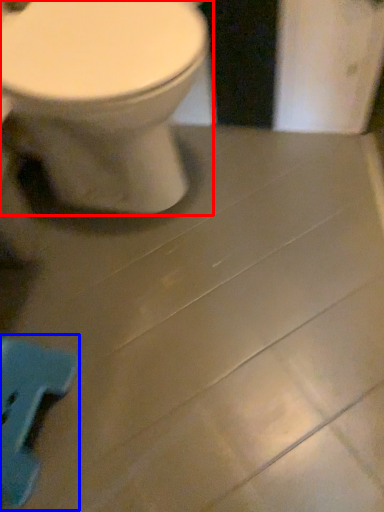
Question: Which point is further to the camera, toilet (highlighted by a red box) or porcelain (highlighted by a blue box)?

Choices:
 (A) toilet
 (B) porcelain

Answer: (B)